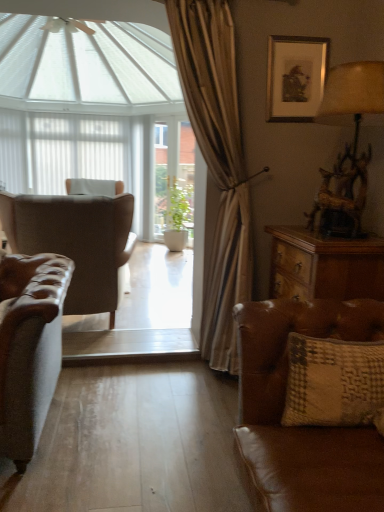
Question: Is textured beige pillow at lower right situated inside white sheer curtain at upper center or outside?

Choices:
 (A) outside
 (B) inside

Answer: (A)

Question: From the image's perspective, is textured beige pillow at lower right located above or below white sheer curtain at upper center?

Choices:
 (A) above
 (B) below

Answer: (B)

Question: Considering the real-world distances, which object is farthest from the green matte plant at center?

Choices:
 (A) wooden textured lamp at upper right
 (B) silver metallic picture frame at upper right
 (C) white matte shutter at left
 (D) brown leather couch at lower right
 (E) leather wingback chair at left

Answer: (D)

Question: Estimate the real-world distances between objects in this image. Which object is closer to the leather wingback chair at left?

Choices:
 (A) silver metallic picture frame at upper right
 (B) textured beige pillow at lower right
 (C) white sheer curtain at upper center
 (D) white matte shutter at left
 (E) green matte plant at center

Answer: (A)